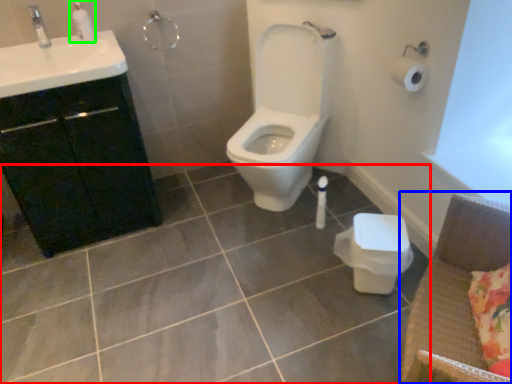
Question: Estimate the real-world distances between objects in this image. Which object is farther from ceramic tile (highlighted by a red box), armchair (highlighted by a blue box) or soap dispenser (highlighted by a green box)?

Choices:
 (A) armchair
 (B) soap dispenser

Answer: (B)